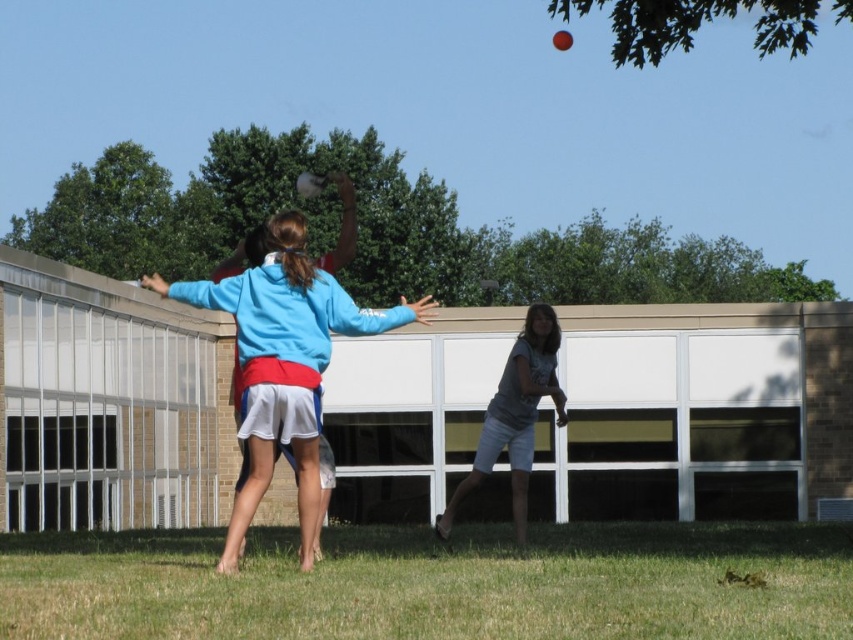
Question: Can you confirm if blue fabric jacket at center is positioned above gray cotton shorts at center?

Choices:
 (A) no
 (B) yes

Answer: (B)

Question: Can you confirm if blue fabric jacket at center is positioned below gray cotton shorts at center?

Choices:
 (A) no
 (B) yes

Answer: (A)

Question: Which of the following is the farthest from the observer?

Choices:
 (A) (527, 371)
 (B) (280, 355)

Answer: (A)

Question: From the image, what is the correct spatial relationship of blue fabric jacket at center in relation to gray cotton shorts at center?

Choices:
 (A) below
 (B) above

Answer: (B)

Question: Which of the following is the farthest from the observer?

Choices:
 (A) blue fabric jacket at center
 (B) gray cotton shorts at center

Answer: (B)